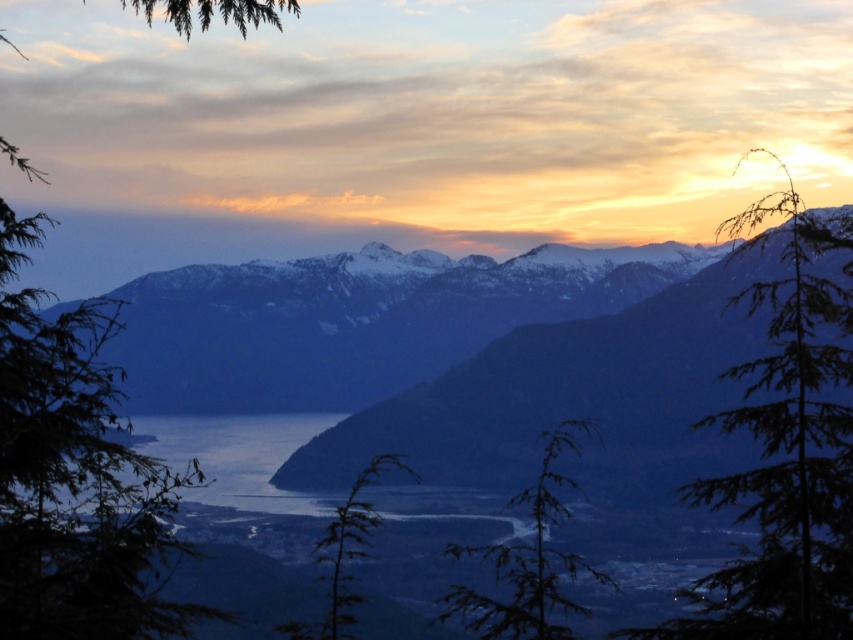
Does snowy mountain range at center have a lesser height compared to green matte tree at left?

Indeed, snowy mountain range at center has a lesser height compared to green matte tree at left.

Is snowy mountain range at center smaller than green matte tree at left?

Indeed, snowy mountain range at center has a smaller size compared to green matte tree at left.

Between point (465, 340) and point (19, 163), which one is positioned in front?

Positioned in front is point (19, 163).

I want to click on snowy mountain range at center, so click(357, 321).

Who is positioned more to the right, green matte tree at left or green fuzzy plant at center?

Positioned to the right is green fuzzy plant at center.

Find the location of `green matte tree at left`. green matte tree at left is located at coordinates (74, 476).

Does green matte tree at left have a larger size compared to green matte tree at center?

Indeed, green matte tree at left has a larger size compared to green matte tree at center.

Can you confirm if green matte tree at left is positioned to the right of green matte tree at center?

In fact, green matte tree at left is to the left of green matte tree at center.

Identify the location of green matte tree at left. (74, 476).